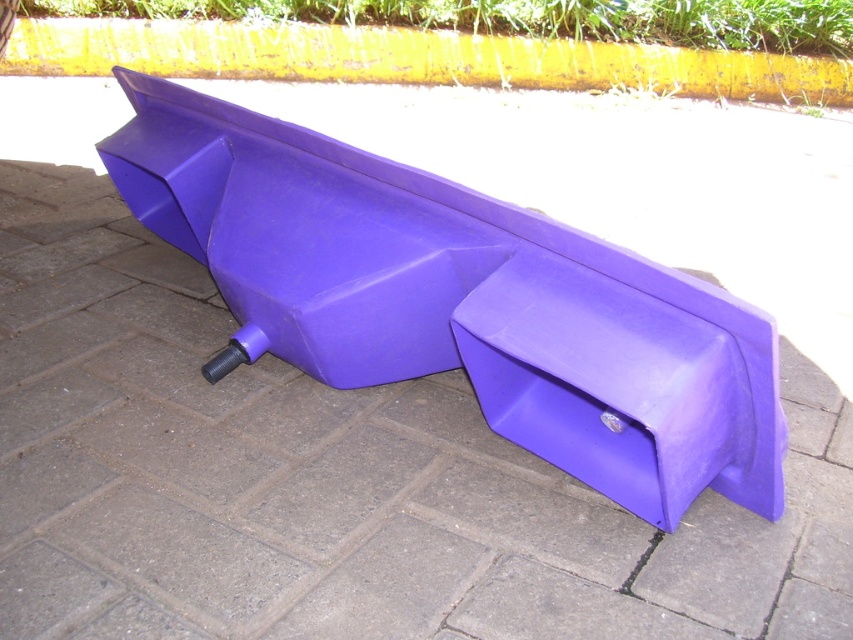
Question: Does matte purple handcart at center lie in front of yellow painted curb at upper center?

Choices:
 (A) no
 (B) yes

Answer: (B)

Question: Is matte purple handcart at center further to the viewer compared to yellow painted curb at upper center?

Choices:
 (A) yes
 (B) no

Answer: (B)

Question: Which point is farther to the camera?

Choices:
 (A) (622, 44)
 (B) (392, 381)

Answer: (A)

Question: Among these objects, which one is nearest to the camera?

Choices:
 (A) matte purple handcart at center
 (B) yellow painted curb at upper center

Answer: (A)

Question: Does matte purple handcart at center appear under yellow painted curb at upper center?

Choices:
 (A) no
 (B) yes

Answer: (B)